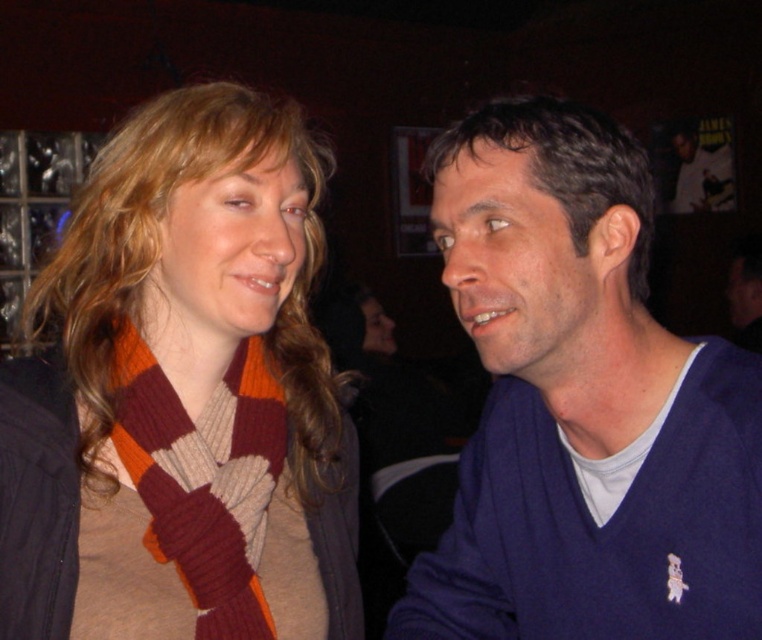
Is dark brown smooth hair at upper right thinner than matte blue sweater at right?

Correct, dark brown smooth hair at upper right's width is less than matte blue sweater at right's.

Measure the distance between dark brown smooth hair at upper right and matte blue sweater at right.

They are 9.51 feet apart.

The width and height of the screenshot is (762, 640). I want to click on dark brown smooth hair at upper right, so click(565, 164).

Can you confirm if blue sweater at right is smaller than knitted wool scarf at left?

Actually, blue sweater at right might be larger than knitted wool scarf at left.

Can you confirm if blue sweater at right is bigger than knitted wool scarf at left?

Indeed, blue sweater at right has a larger size compared to knitted wool scarf at left.

Where is `blue sweater at right`? This screenshot has height=640, width=762. blue sweater at right is located at coordinates (581, 404).

Does knitted scarf at center have a lesser width compared to knitted wool scarf at left?

No, knitted scarf at center is not thinner than knitted wool scarf at left.

Does point (37, 541) come closer to viewer compared to point (258, 436)?

Yes, it is.

Measure the distance between knitted scarf at center and camera.

knitted scarf at center and camera are 32.04 inches apart.

Find the location of a particular element. The height and width of the screenshot is (640, 762). knitted scarf at center is located at coordinates (181, 396).